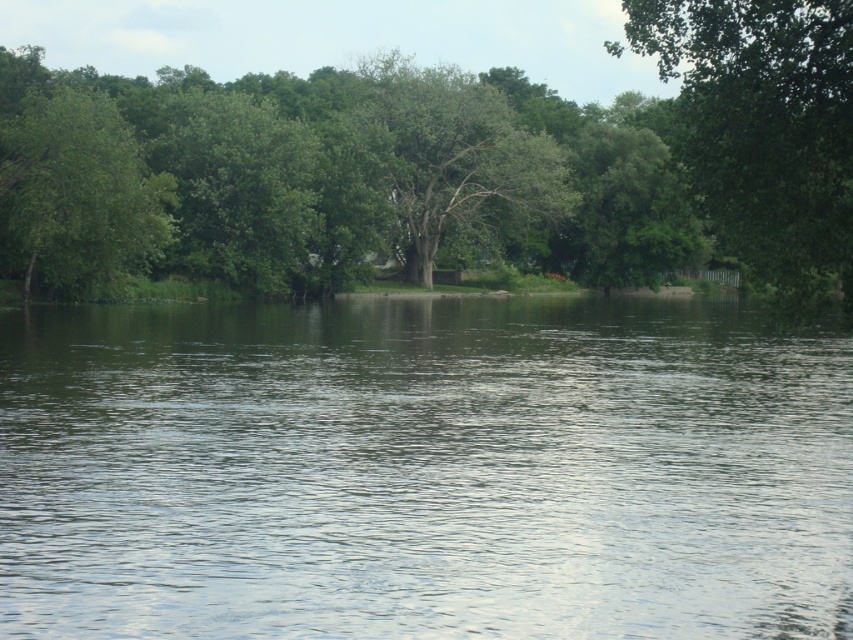
You are standing at the edge of the water and want to walk to the green leafy tree at upper right. Which direction should you head relative to the green leafy tree at center?

You should head to the right of the green leafy tree at center because the green leafy tree at upper right is positioned to the right of it.